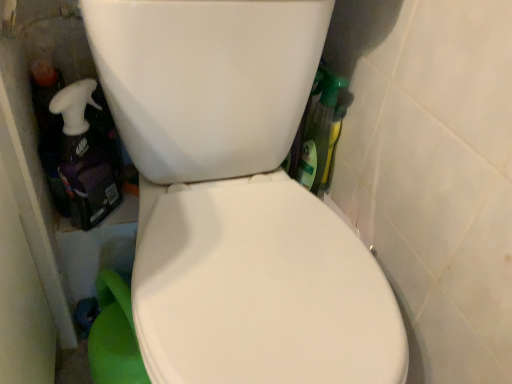
What do you see at coordinates (84, 158) in the screenshot?
I see `translucent purple spray bottle at left` at bounding box center [84, 158].

Locate an element on the screen. This screenshot has width=512, height=384. translucent purple spray bottle at left is located at coordinates (84, 158).

The height and width of the screenshot is (384, 512). Find the location of `white glossy toilet at center`. white glossy toilet at center is located at coordinates (236, 199).

Measure the distance between white glossy toilet at center and camera.

They are 17.37 inches apart.

What do you see at coordinates (236, 199) in the screenshot? I see `white glossy toilet at center` at bounding box center [236, 199].

Where is `translucent purple spray bottle at left`? translucent purple spray bottle at left is located at coordinates (84, 158).

Would you say translucent purple spray bottle at left is to the left or to the right of white glossy toilet at center in the picture?

translucent purple spray bottle at left is positioned on white glossy toilet at center's left side.

From the picture: Is translucent purple spray bottle at left positioned behind white glossy toilet at center?

That is True.

Is point (69, 137) less distant than point (233, 97)?

No, (69, 137) is further to viewer.

From the image's perspective, which object appears higher, translucent purple spray bottle at left or white glossy toilet at center?

translucent purple spray bottle at left is shown above in the image.

Based on the photo, from a real-world perspective, is translucent purple spray bottle at left beneath white glossy toilet at center?

No, from a real-world perspective, translucent purple spray bottle at left is not under white glossy toilet at center.

Considering the sizes of translucent purple spray bottle at left and white glossy toilet at center in the image, is translucent purple spray bottle at left wider or thinner than white glossy toilet at center?

translucent purple spray bottle at left is thinner than white glossy toilet at center.

From their relative heights in the image, would you say translucent purple spray bottle at left is taller or shorter than white glossy toilet at center?

Considering their sizes, translucent purple spray bottle at left has less height than white glossy toilet at center.

Does translucent purple spray bottle at left have a smaller size compared to white glossy toilet at center?

Yes.

Is translucent purple spray bottle at left outside of white glossy toilet at center?

That's correct, translucent purple spray bottle at left is outside of white glossy toilet at center.

From the picture: Does translucent purple spray bottle at left touch white glossy toilet at center?

No, translucent purple spray bottle at left is not next to white glossy toilet at center.

From the picture: Is translucent purple spray bottle at left turned away from white glossy toilet at center?

No, translucent purple spray bottle at left is not facing the opposite direction of white glossy toilet at center.

How many degrees apart are the facing directions of translucent purple spray bottle at left and white glossy toilet at center?

The angular difference between translucent purple spray bottle at left and white glossy toilet at center is 0.905 degrees.

You are a GUI agent. You are given a task and a screenshot of the screen. Output one action in this format:
    pyautogui.click(x=<x>, y=<y>)
    Task: Click on the cleaning product on the left of white glossy toilet at center
    The height and width of the screenshot is (384, 512).
    Given the screenshot: What is the action you would take?
    pyautogui.click(x=84, y=158)

Considering the positions of objects white glossy toilet at center and translucent purple spray bottle at left in the image provided, who is more to the left, white glossy toilet at center or translucent purple spray bottle at left?

translucent purple spray bottle at left.

Which is behind, white glossy toilet at center or translucent purple spray bottle at left?

translucent purple spray bottle at left is more distant.

Which point is more distant from viewer, (179, 60) or (80, 121)?

The point (80, 121) is more distant.

From the image's perspective, is white glossy toilet at center positioned above or below translucent purple spray bottle at left?

Clearly, from the image's perspective, white glossy toilet at center is below translucent purple spray bottle at left.

From a real-world perspective, which is physically below, white glossy toilet at center or translucent purple spray bottle at left?

From a 3D spatial view, white glossy toilet at center is below.

From the picture: Is white glossy toilet at center wider than translucent purple spray bottle at left?

Correct, the width of white glossy toilet at center exceeds that of translucent purple spray bottle at left.

Does white glossy toilet at center have a greater height compared to translucent purple spray bottle at left?

Yes.

Based on their sizes in the image, would you say white glossy toilet at center is bigger or smaller than translucent purple spray bottle at left?

Clearly, white glossy toilet at center is larger in size than translucent purple spray bottle at left.

Is white glossy toilet at center completely or partially outside of translucent purple spray bottle at left?

white glossy toilet at center is positioned outside translucent purple spray bottle at left.

Is white glossy toilet at center in contact with translucent purple spray bottle at left?

white glossy toilet at center and translucent purple spray bottle at left are clearly separated.

Could you tell me if white glossy toilet at center is facing translucent purple spray bottle at left?

No, white glossy toilet at center is not oriented towards translucent purple spray bottle at left.

How much distance is there between white glossy toilet at center and translucent purple spray bottle at left?

white glossy toilet at center and translucent purple spray bottle at left are 10.47 inches apart.

At what (x,y) coordinates should I click in order to perform the action: click on toilet lying on the right of translucent purple spray bottle at left. Please return your answer as a coordinate pair (x, y). This screenshot has height=384, width=512. Looking at the image, I should click on (236, 199).

In the image, there is a translucent purple spray bottle at left. At what (x,y) coordinates should I click in order to perform the action: click on toilet below it (from the image's perspective). Please return your answer as a coordinate pair (x, y). The height and width of the screenshot is (384, 512). Looking at the image, I should click on (236, 199).

You are a GUI agent. You are given a task and a screenshot of the screen. Output one action in this format:
    pyautogui.click(x=<x>, y=<y>)
    Task: Click on the toilet lying on the right of translucent purple spray bottle at left
    
    Given the screenshot: What is the action you would take?
    pyautogui.click(x=236, y=199)